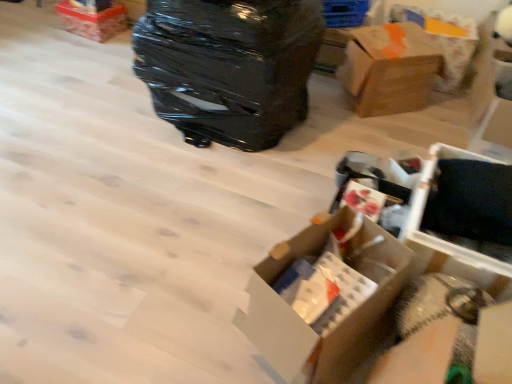
Where is `free location to the right of black plastic suitcase at upper center`? Image resolution: width=512 pixels, height=384 pixels. free location to the right of black plastic suitcase at upper center is located at coordinates click(x=328, y=128).